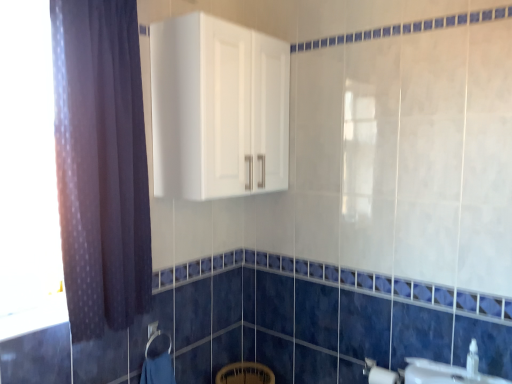
Question: Are transparent glass window at left and white glossy sink at lower right beside each other?

Choices:
 (A) yes
 (B) no

Answer: (B)

Question: Considering the relative sizes of transparent glass window at left and white glossy sink at lower right in the image provided, is transparent glass window at left wider than white glossy sink at lower right?

Choices:
 (A) no
 (B) yes

Answer: (B)

Question: Can you confirm if transparent glass window at left is positioned to the right of white glossy sink at lower right?

Choices:
 (A) no
 (B) yes

Answer: (A)

Question: Could you tell me if transparent glass window at left is turned towards white glossy sink at lower right?

Choices:
 (A) yes
 (B) no

Answer: (B)

Question: Is transparent glass window at left behind white glossy sink at lower right?

Choices:
 (A) yes
 (B) no

Answer: (B)

Question: From the image's perspective, is blue soft towel at lower center located above or below white glossy cabinet at upper center?

Choices:
 (A) below
 (B) above

Answer: (A)

Question: Considering the relative positions of blue soft towel at lower center and white glossy cabinet at upper center in the image provided, is blue soft towel at lower center to the left or to the right of white glossy cabinet at upper center?

Choices:
 (A) left
 (B) right

Answer: (A)

Question: From a real-world perspective, relative to white glossy cabinet at upper center, is blue soft towel at lower center vertically above or below?

Choices:
 (A) below
 (B) above

Answer: (A)

Question: Is point coord(151,382) positioned closer to the camera than point coord(173,137)?

Choices:
 (A) closer
 (B) farther

Answer: (B)

Question: In terms of size, does white glossy sink at lower right appear bigger or smaller than white matte toilet paper at lower right?

Choices:
 (A) small
 (B) big

Answer: (A)

Question: Is white glossy sink at lower right in front of or behind white matte toilet paper at lower right in the image?

Choices:
 (A) front
 (B) behind

Answer: (A)

Question: From their relative heights in the image, would you say white glossy sink at lower right is taller or shorter than white matte toilet paper at lower right?

Choices:
 (A) short
 (B) tall

Answer: (A)

Question: Looking at their shapes, would you say white glossy sink at lower right is wider or thinner than white matte toilet paper at lower right?

Choices:
 (A) thin
 (B) wide

Answer: (A)

Question: Considering the positions of blue soft towel at lower center and dark purple fabric at left in the image, is blue soft towel at lower center wider or thinner than dark purple fabric at left?

Choices:
 (A) wide
 (B) thin

Answer: (B)

Question: Relative to dark purple fabric at left, is blue soft towel at lower center in front or behind?

Choices:
 (A) behind
 (B) front

Answer: (A)